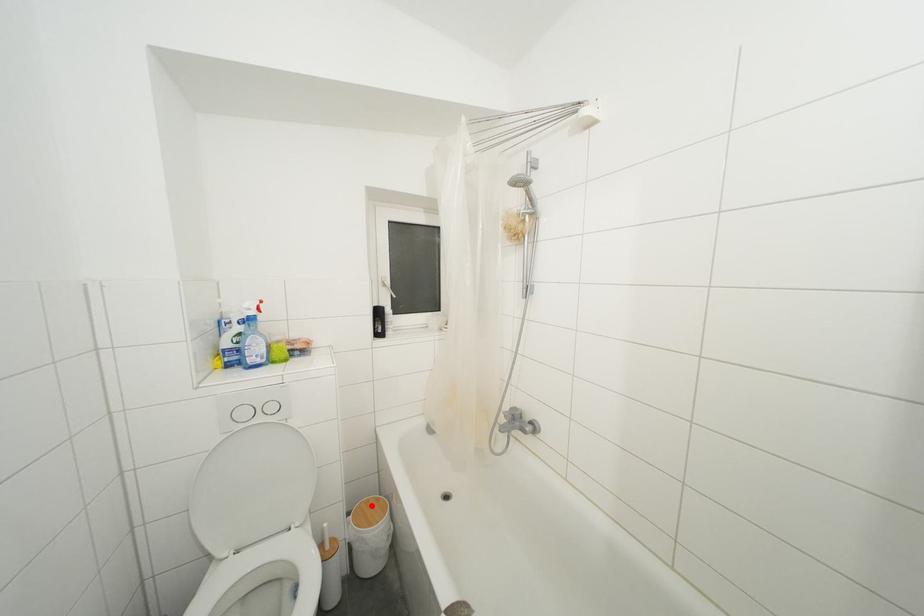
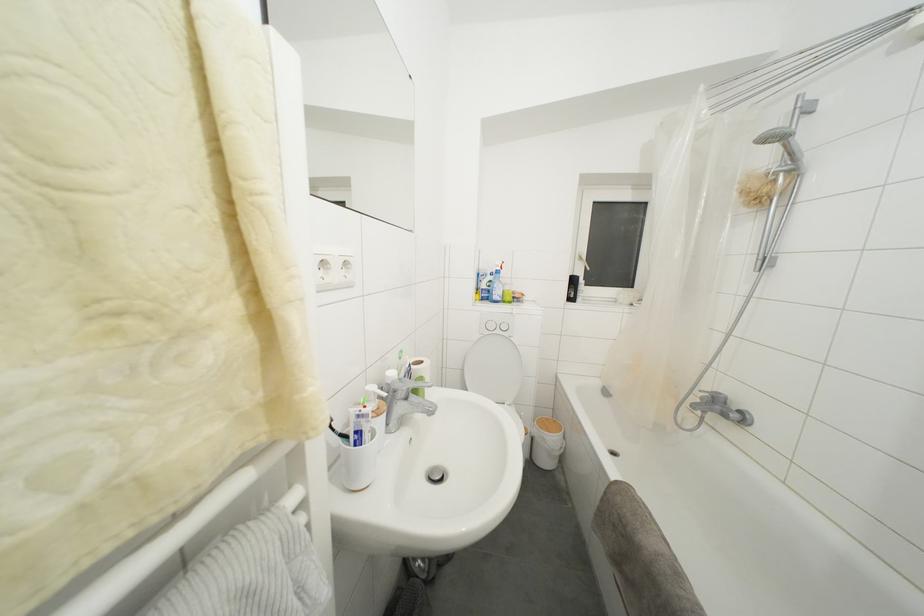
Locate, in the second image, the point that corresponds to the highlighted location in the first image.

(552, 424)